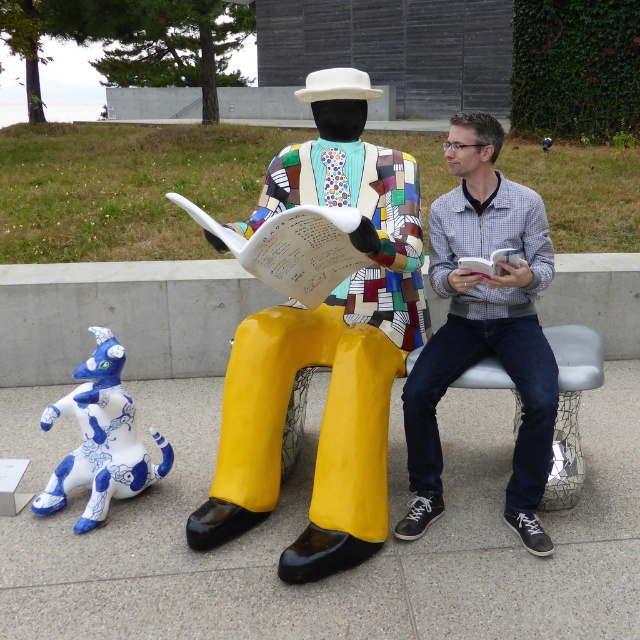
Question: In this image, where is matte multicolored suit at center located relative to matte gray shirt at center?

Choices:
 (A) below
 (B) above

Answer: (B)

Question: Can you confirm if matte multicolored suit at center is positioned to the left of matte gray shirt at center?

Choices:
 (A) no
 (B) yes

Answer: (B)

Question: Among these objects, which one is nearest to the camera?

Choices:
 (A) matte gray shirt at center
 (B) blue glossy ceramic dog at lower left

Answer: (A)

Question: Which of the following is the closest to the observer?

Choices:
 (A) (108, 396)
 (B) (300, 349)
 (C) (410, 412)

Answer: (C)

Question: Which object appears farthest from the camera in this image?

Choices:
 (A) blue glossy ceramic dog at lower left
 (B) matte gray shirt at center
 (C) matte multicolored suit at center

Answer: (A)

Question: Is matte gray shirt at center in front of blue glossy ceramic dog at lower left?

Choices:
 (A) yes
 (B) no

Answer: (A)